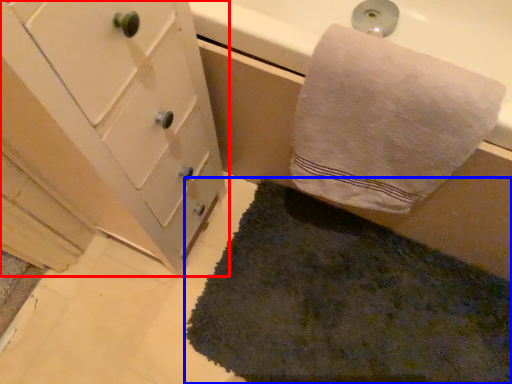
Question: Which object is closer to the camera taking this photo, bathroom cabinet (highlighted by a red box) or bath mat (highlighted by a blue box)?

Choices:
 (A) bathroom cabinet
 (B) bath mat

Answer: (A)